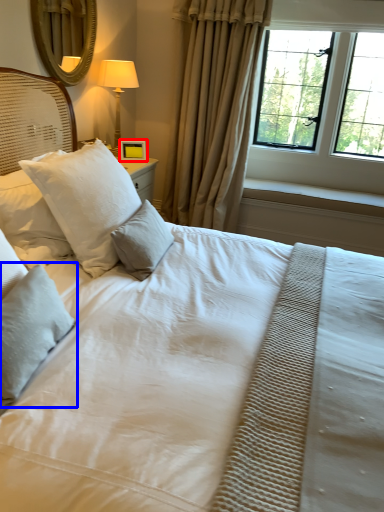
Question: Which point is further to the camera, picture frame (highlighted by a red box) or pillow (highlighted by a blue box)?

Choices:
 (A) picture frame
 (B) pillow

Answer: (A)